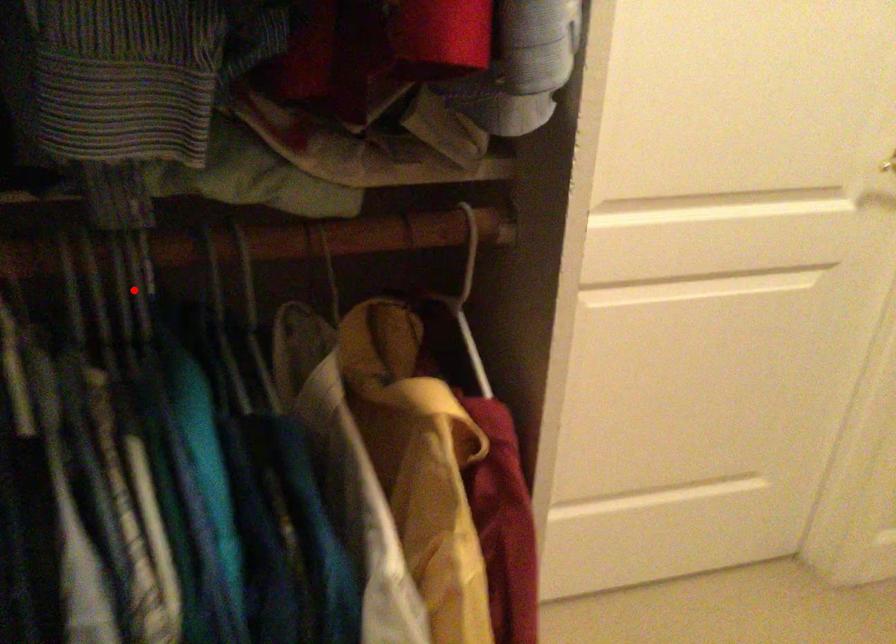
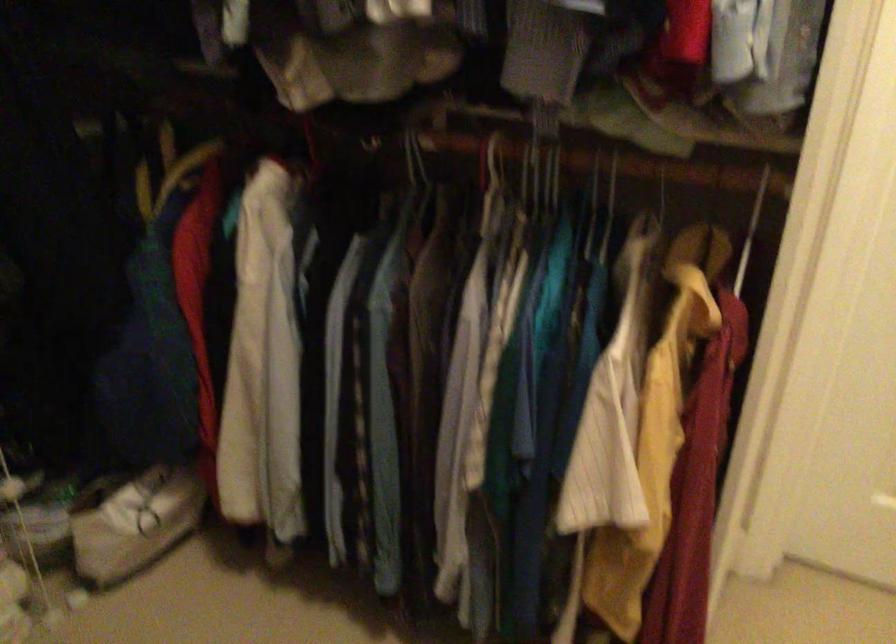
Locate, in the second image, the point that corresponds to the highlighted location in the first image.

(554, 176)